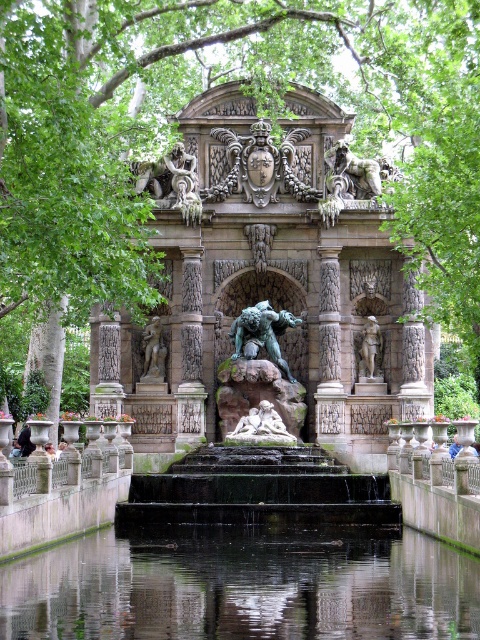
Is white marble reclining couple at center above polished bronze statue at center?

No.

Is point (257, 428) farther from camera compared to point (373, 320)?

No, it is in front of (373, 320).

Is point (250, 432) more distant than point (360, 371)?

No, it is not.

Locate an element on the screen. The width and height of the screenshot is (480, 640). white marble reclining couple at center is located at coordinates (261, 426).

Locate an element on the screen. green leafy tree at upper center is located at coordinates (245, 198).

Is green leafy tree at upper center below bronze statue at center?

Incorrect, green leafy tree at upper center is not positioned below bronze statue at center.

Which is behind, point (86, 161) or point (156, 326)?

Positioned behind is point (156, 326).

Find the location of `green leafy tree at upper center`. green leafy tree at upper center is located at coordinates (245, 198).

I want to click on green leafy tree at upper center, so click(x=245, y=198).

Who is shorter, green leafy tree at upper center or transparent liquid water at center?

Standing shorter between the two is transparent liquid water at center.

Is point (397, 355) positioned after point (228, 552)?

Yes, it is.

The image size is (480, 640). I want to click on green leafy tree at upper center, so click(245, 198).